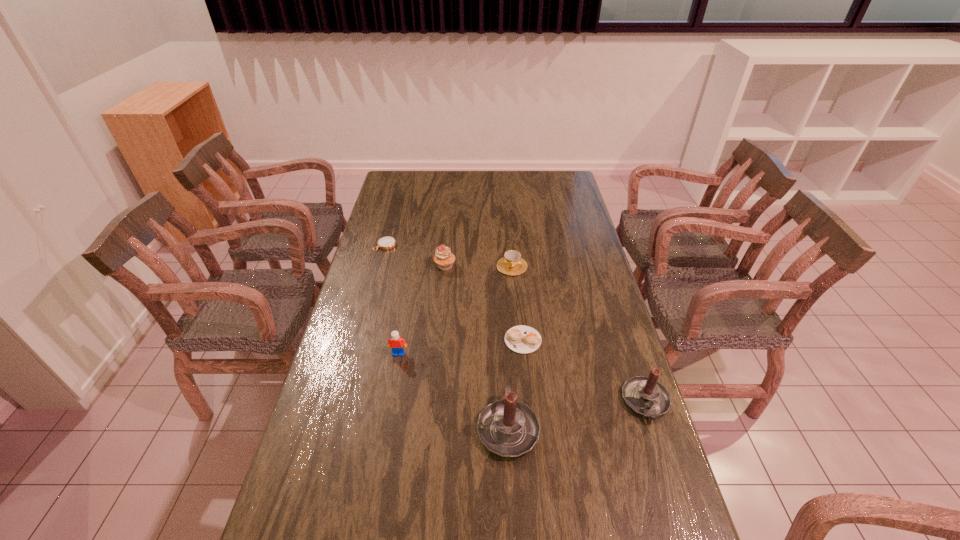
Locate an element on the screen. This screenshot has width=960, height=540. the left candle is located at coordinates (509, 428).

Where is `the taller candle`? This screenshot has height=540, width=960. the taller candle is located at coordinates (509, 428).

Locate an element on the screen. This screenshot has width=960, height=540. the sixth shortest object is located at coordinates (644, 395).

Image resolution: width=960 pixels, height=540 pixels. I want to click on the right candle, so click(x=644, y=395).

Locate an element on the screen. Image resolution: width=960 pixels, height=540 pixels. cup is located at coordinates (511, 264).

You are a GUI agent. You are given a task and a screenshot of the screen. Output one action in this format:
    pyautogui.click(x=<x>, y=<y>)
    Task: Click on the fifth object from right to left
    The image size is (960, 540).
    Given the screenshot: What is the action you would take?
    pyautogui.click(x=443, y=257)

This screenshot has height=540, width=960. What are the coordinates of `the shortest object` in the screenshot? It's located at (385, 243).

Find the location of a particular element. This screenshot has height=540, width=960. the farthest object is located at coordinates (385, 243).

The width and height of the screenshot is (960, 540). Identify the location of the second object from left to right. (396, 343).

In order to click on cappuccino in this screenshot , I will do `click(523, 339)`.